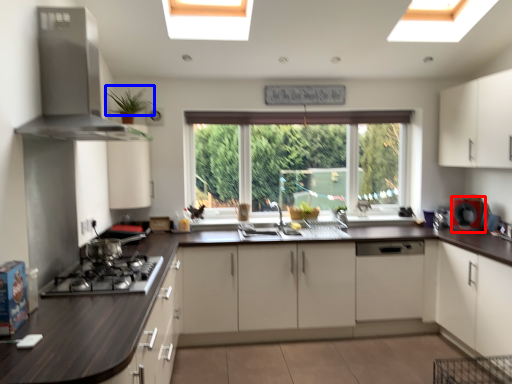
Question: Which of the following is the closest to the observer, appliance (highlighted by a red box) or plant (highlighted by a blue box)?

Choices:
 (A) appliance
 (B) plant

Answer: (B)